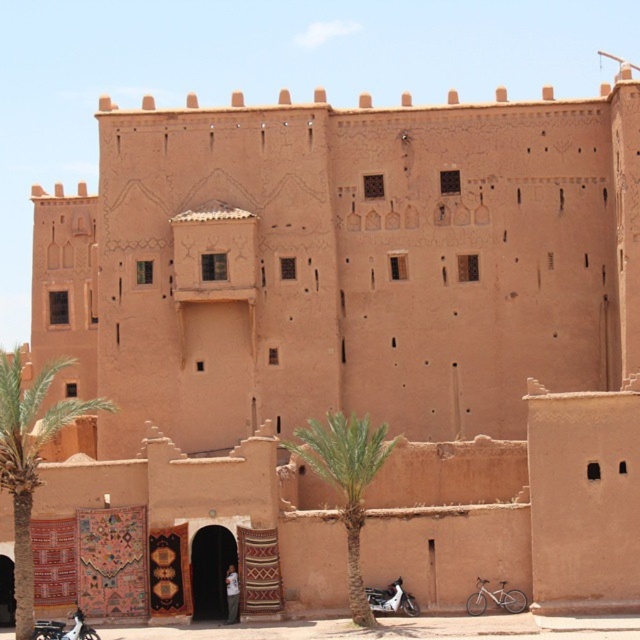
You are standing at the entrance of the kasbah and want to park your white matte motorcycle at lower right near the green leafy palm tree at center. Can you park it directly under the palm tree?

The green leafy palm tree at center is above the white matte motorcycle at lower right, so yes, you can park the white matte motorcycle at lower right directly under the palm tree.

You are standing at the entrance of the kasbah and want to take a photo of the green leafy palm tree at left. Based on its coordinates, is the palm tree located to the left or right side of the image?

The green leafy palm tree at left is located at coordinates point (29, 458), which places it on the left side of the image.

You are standing at the entrance of the kasbah and want to plant a new palm tree exactly where the green leafy palm tree at center is currently located. Is this possible?

The green leafy palm tree at center is already planted at point (346,481), so you cannot plant another one there.